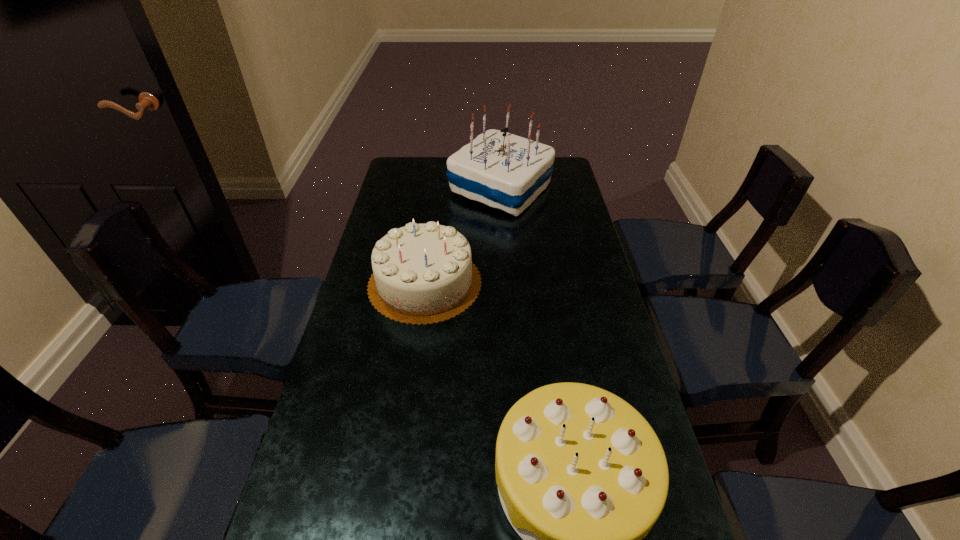
Locate an element on the screen. the tallest object is located at coordinates point(502,170).

Locate an element on the screen. the farthest birthday cake is located at coordinates (502, 170).

This screenshot has width=960, height=540. I want to click on the second nearest birthday cake, so click(x=423, y=274).

You are a GUI agent. You are given a task and a screenshot of the screen. Output one action in this format:
    pyautogui.click(x=<x>, y=<y>)
    Task: Click on the vacant region located on the front of the farthest birthday cake
    
    Given the screenshot: What is the action you would take?
    pyautogui.click(x=504, y=242)

I want to click on vacant space located on the right of the second farthest birthday cake, so click(x=539, y=283).

Find the location of `object that is at the far edge`. object that is at the far edge is located at coordinates (502, 170).

This screenshot has width=960, height=540. What are the coordinates of `object located at the left edge` in the screenshot? It's located at (423, 274).

You are a GUI agent. You are given a task and a screenshot of the screen. Output one action in this format:
    pyautogui.click(x=<x>, y=<y>)
    Task: Click on the object that is at the right edge
    Image resolution: width=960 pixels, height=540 pixels.
    Given the screenshot: What is the action you would take?
    [502, 170]

Where is `object present at the far right corner`? object present at the far right corner is located at coordinates (502, 170).

Image resolution: width=960 pixels, height=540 pixels. In order to click on vacant position at the left edge of the desktop in this screenshot , I will do `click(367, 348)`.